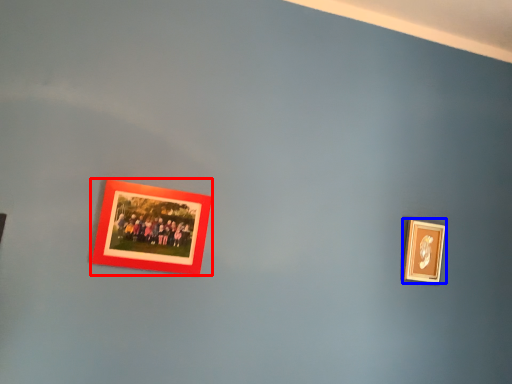
Question: Which object is further to the camera taking this photo, picture frame (highlighted by a red box) or picture frame (highlighted by a blue box)?

Choices:
 (A) picture frame
 (B) picture frame

Answer: (B)